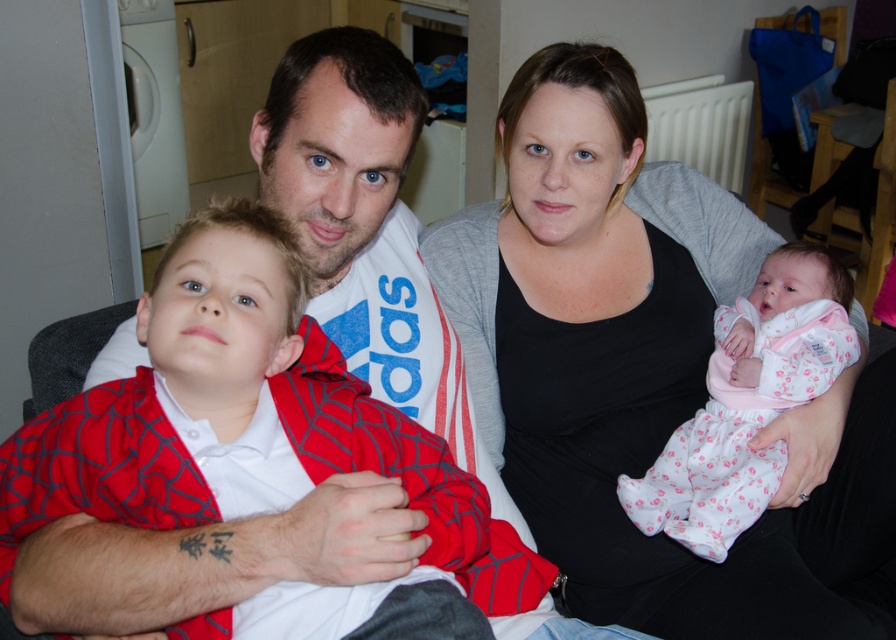
You are standing at the origin point in this family photo. You need to walk to the point labeled as point (800, 522) and then to point (338, 387). Which point will you reach first?

You will reach point (338, 387) first because it is in front of point (800, 522), so you must go there first before reaching the other point.